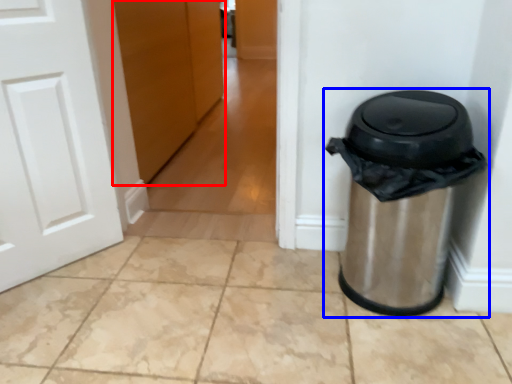
Question: Which object is further to the camera taking this photo, door (highlighted by a red box) or waste container (highlighted by a blue box)?

Choices:
 (A) door
 (B) waste container

Answer: (A)